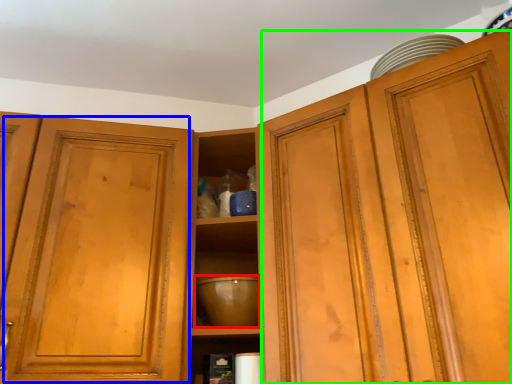
Question: Estimate the real-world distances between objects in this image. Which object is farther from mixing bowl (highlighted by a red box), glass door (highlighted by a blue box) or cabinetry (highlighted by a green box)?

Choices:
 (A) glass door
 (B) cabinetry

Answer: (B)